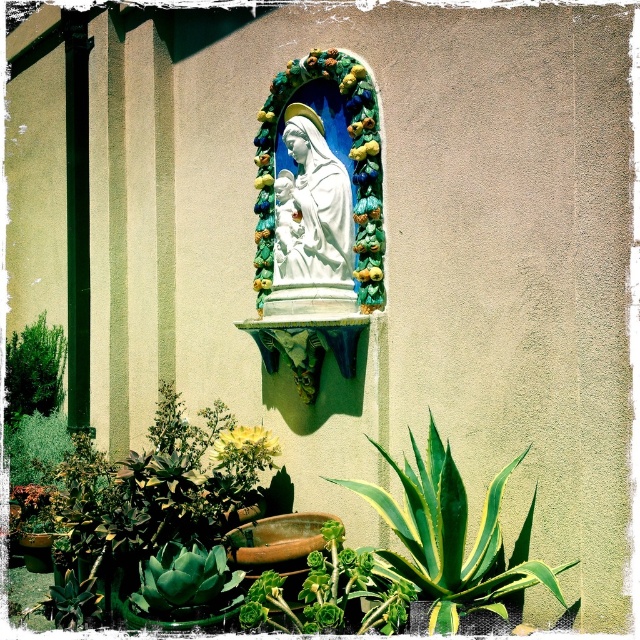
Question: Based on their relative distances, which object is nearer to the smooth red flower at lower left?

Choices:
 (A) green succulent at center
 (B) white marble statue at center

Answer: (B)

Question: Which object is the closest to the green succulent at center?

Choices:
 (A) yellow matte flower at center
 (B) green leafy plant at lower right
 (C) green leafy bush at left
 (D) white marble statue at center

Answer: (B)

Question: Among these points, which one is farthest from the camera?

Choices:
 (A) (40, 316)
 (B) (396, 618)
 (C) (52, 490)
 (D) (291, 129)

Answer: (A)

Question: Is green succulent at center behind smooth red flower at lower left?

Choices:
 (A) yes
 (B) no

Answer: (B)

Question: Does green leafy plant at lower right have a lesser width compared to yellow matte flower at center?

Choices:
 (A) no
 (B) yes

Answer: (A)

Question: Is green leafy plant at lower right smaller than white marble statue at center?

Choices:
 (A) yes
 (B) no

Answer: (B)